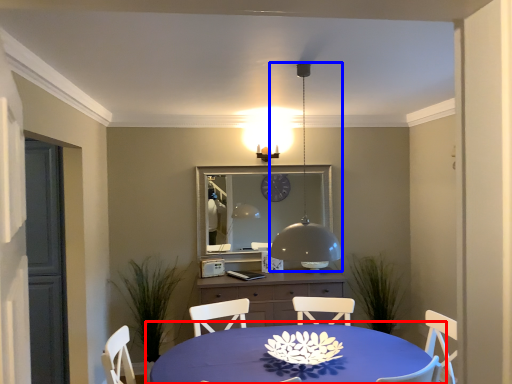
Question: Which point is further to the camera, table (highlighted by a red box) or lamp (highlighted by a blue box)?

Choices:
 (A) table
 (B) lamp

Answer: (B)